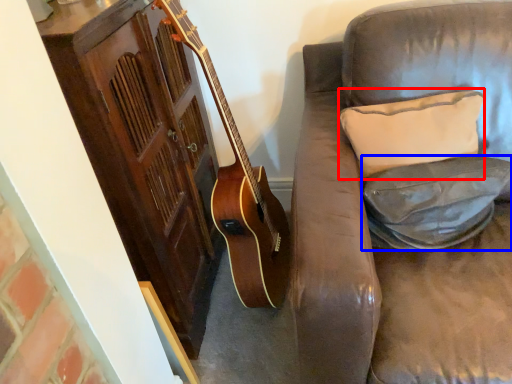
Question: Which object is closer to the camera taking this photo, pillow (highlighted by a red box) or pillow (highlighted by a blue box)?

Choices:
 (A) pillow
 (B) pillow

Answer: (B)